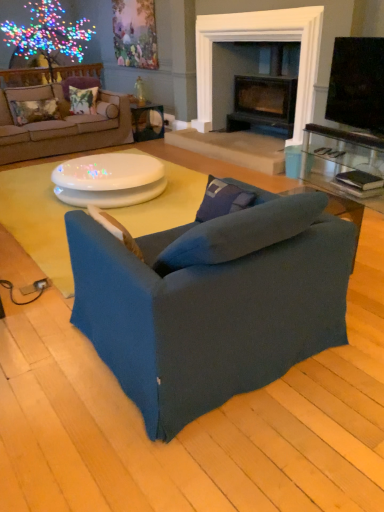
Question: Considering the positions of suede-like blue pillow at center, which is the 1th pillow from bottom to top, and matte white table at center, the 2th table positioned from the bottom, in the image, is suede-like blue pillow at center, which is the 1th pillow from bottom to top, taller or shorter than matte white table at center, the 2th table positioned from the bottom,?

Choices:
 (A) tall
 (B) short

Answer: (B)

Question: Looking at their shapes, would you say suede-like blue pillow at center, which is the first pillow in front-to-back order, is wider or thinner than matte white table at center, arranged as the 1th table when viewed from the back?

Choices:
 (A) thin
 (B) wide

Answer: (A)

Question: Estimate the real-world distances between objects in this image. Which object is farther from the matte white table at center, arranged as the second table when viewed from the front?

Choices:
 (A) floral fabric pillow at upper left, which ranks as the third pillow in right-to-left order
 (B) beige fabric couch at upper left, which is the second studio couch in bottom-to-top order
 (C) white glossy coffee table at center, which ranks as the 2th table in top-to-bottom order
 (D) clear glass side table at right
 (E) suede-like blue pillow at center, the 4th pillow in the back-to-front sequence

Answer: (E)

Question: Based on their relative distances, which object is nearer to the black glossy tv at upper right?

Choices:
 (A) floral fabric cushion at upper left, which is counted as the 4th pillow, starting from the right
 (B) beige fabric couch at upper left, the 2th studio couch when ordered from front to back
 (C) white glossy coffee table at center, which is the 2th table in back-to-front order
 (D) matte white table at center, which ranks as the 1th table in top-to-bottom order
 (E) clear glass side table at right

Answer: (E)